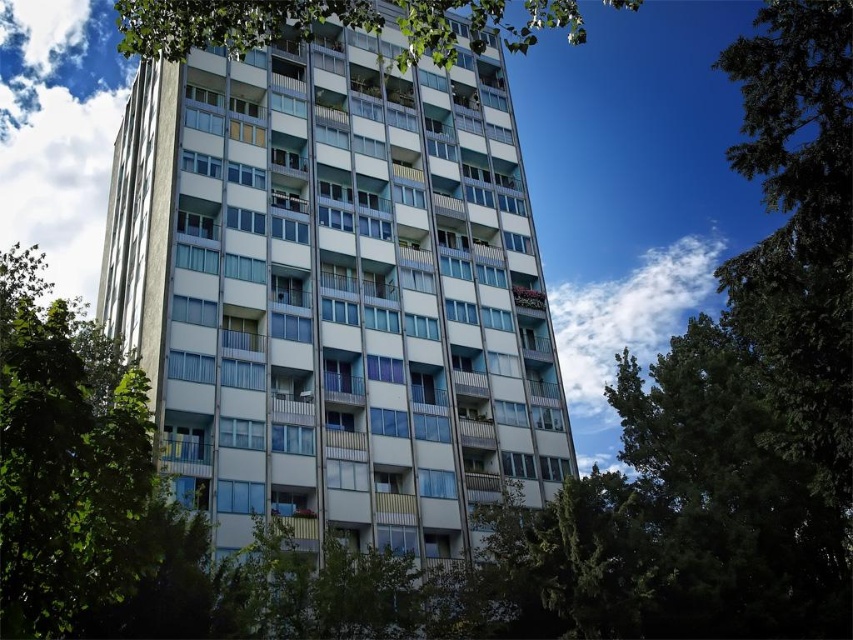
You are a GUI agent. You are given a task and a screenshot of the screen. Output one action in this format:
    pyautogui.click(x=<x>, y=<y>)
    Task: Click on the green leafy tree at center
    This screenshot has width=853, height=640.
    Given the screenshot: What is the action you would take?
    pyautogui.click(x=735, y=396)

In order to click on green leafy tree at center in this screenshot , I will do `click(735, 396)`.

Who is positioned more to the left, white glass building at center or green leafy tree at center?

white glass building at center

Who is more distant from viewer, (x=498, y=493) or (x=727, y=396)?

Point (x=498, y=493)

Where is `white glass building at center`? The width and height of the screenshot is (853, 640). white glass building at center is located at coordinates (335, 289).

Is white glass building at center shorter than green leafy tree at upper center?

Yes, white glass building at center is shorter than green leafy tree at upper center.

Is point (274, 122) farther from camera compared to point (224, 38)?

Yes, point (274, 122) is behind point (224, 38).

This screenshot has width=853, height=640. Describe the element at coordinates (335, 289) in the screenshot. I see `white glass building at center` at that location.

This screenshot has width=853, height=640. Identify the location of white glass building at center. (335, 289).